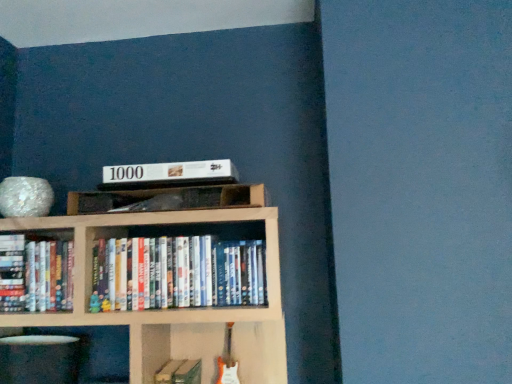
Question: Relative to hardcover book at center, which appears as the 1th book when ordered from the bottom, is white matte book at upper center in front or behind?

Choices:
 (A) behind
 (B) front

Answer: (A)

Question: Is white matte book at upper center wider or thinner than hardcover book at center, acting as the second book starting from the right?

Choices:
 (A) thin
 (B) wide

Answer: (B)

Question: Which of these objects is positioned closest to the white glossy plate at lower left, marked as the 2th shelf in a right-to-left arrangement?

Choices:
 (A) white matte book at upper center
 (B) hardcover books at left, positioned as the 1th book in left-to-right order
 (C) white glossy dvds at center, the first book from the top
 (D) wooden shelf at center, which is the second shelf from bottom to top
 (E) hardcover book at center, which appears as the 1th book when ordered from the bottom

Answer: (C)

Question: Which object is the farthest from the hardcover books at left, positioned as the 1th book in left-to-right order?

Choices:
 (A) hardcover book at center, marked as the 3th book in a top-to-bottom arrangement
 (B) white glossy dvds at center, positioned as the third book in left-to-right order
 (C) wooden shelf at center, which is the first shelf from right to left
 (D) white matte book at upper center
 (E) white glossy plate at lower left, placed as the 1th shelf when sorted from left to right

Answer: (A)